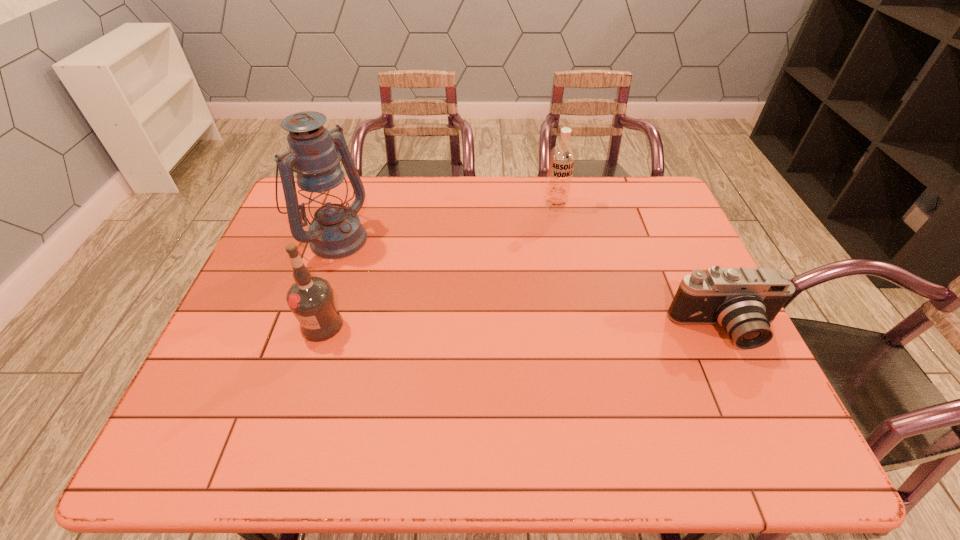
The height and width of the screenshot is (540, 960). What are the coordinates of `free location located on the front-facing side of the tallest object` in the screenshot? It's located at (409, 285).

The width and height of the screenshot is (960, 540). Find the location of `vacant point located on the front-facing side of the tallest object`. vacant point located on the front-facing side of the tallest object is located at coordinates click(375, 265).

Where is `vacant space located on the front label of the farther vodka`? Image resolution: width=960 pixels, height=540 pixels. vacant space located on the front label of the farther vodka is located at coordinates (551, 249).

The height and width of the screenshot is (540, 960). What are the coordinates of `vacant area located 0.050m on the front label of the farther vodka` in the screenshot? It's located at (554, 222).

Find the location of a particular element. Image resolution: width=960 pixels, height=540 pixels. vacant area situated on the front label of the farther vodka is located at coordinates (552, 236).

Where is `lantern positioned at the far edge`? The height and width of the screenshot is (540, 960). lantern positioned at the far edge is located at coordinates (315, 153).

Locate an element on the screen. Image resolution: width=960 pixels, height=540 pixels. vodka that is at the far edge is located at coordinates (562, 157).

Image resolution: width=960 pixels, height=540 pixels. Identify the location of object situated at the left edge. (315, 153).

The width and height of the screenshot is (960, 540). What are the coordinates of `object present at the right edge` in the screenshot? It's located at (744, 301).

Where is `object at the far left corner`? object at the far left corner is located at coordinates (315, 153).